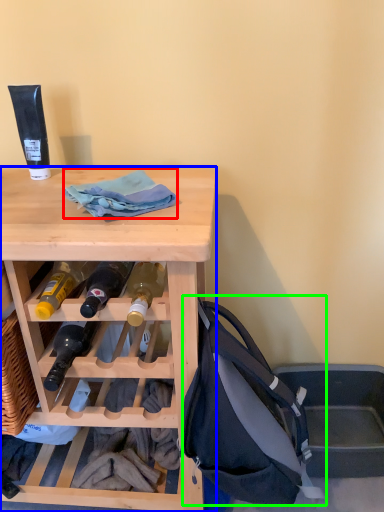
Question: Based on their relative distances, which object is farther from cloth (highlighted by a red box)? Choose from desk (highlighted by a blue box) and handbag (highlighted by a green box).

Choices:
 (A) desk
 (B) handbag

Answer: (B)